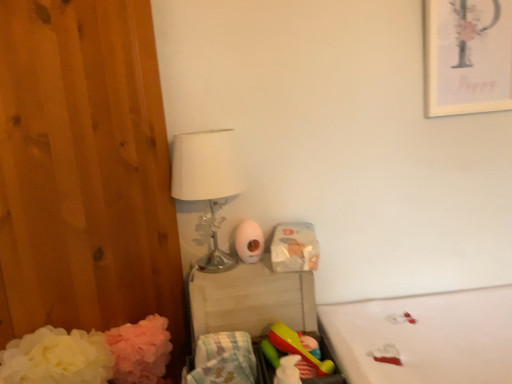
Question: Would you say white glossy table lamp at upper left is inside or outside white fabric mattress at lower right?

Choices:
 (A) outside
 (B) inside

Answer: (A)

Question: Considering the relative positions of white glossy table lamp at upper left and white fabric mattress at lower right in the image provided, is white glossy table lamp at upper left to the left or to the right of white fabric mattress at lower right?

Choices:
 (A) left
 (B) right

Answer: (A)

Question: Estimate the real-world distances between objects in this image. Which object is closer to the white glossy toilet paper at center?

Choices:
 (A) plastic changing table at center
 (B) white glossy table lamp at upper left
 (C) matte white picture frame at upper right
 (D) pastel cotton blanket at lower center
 (E) rubberized yellow and red toy at lower center

Answer: (A)

Question: Based on their relative distances, which object is nearer to the plastic changing table at center?

Choices:
 (A) rubberized yellow and red toy at lower center
 (B) white fabric mattress at lower right
 (C) white glossy table lamp at upper left
 (D) white glossy toilet paper at center
 (E) matte white picture frame at upper right

Answer: (D)